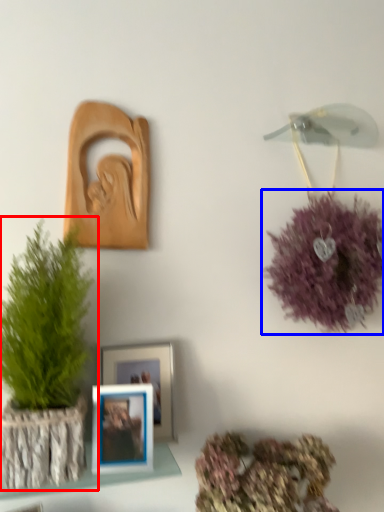
Question: Among these objects, which one is farthest to the camera, houseplant (highlighted by a red box) or flower (highlighted by a blue box)?

Choices:
 (A) houseplant
 (B) flower

Answer: (B)